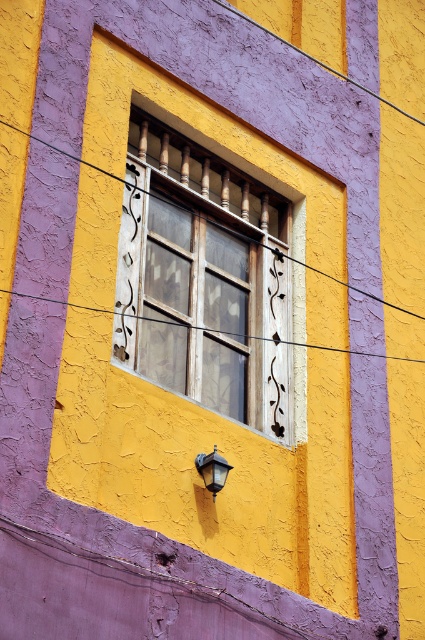
You are a painter hired to touch up the wall between the transparent glass window at center and the matte black lamp at lower center. Which object should you avoid painting because it is in the way?

The transparent glass window at center is located above the matte black lamp at lower center, so you should avoid painting the transparent glass window at center as it is in the way.

What are the coordinates of the transparent glass window at center?

The transparent glass window at center is located at coordinates point (204, 278).